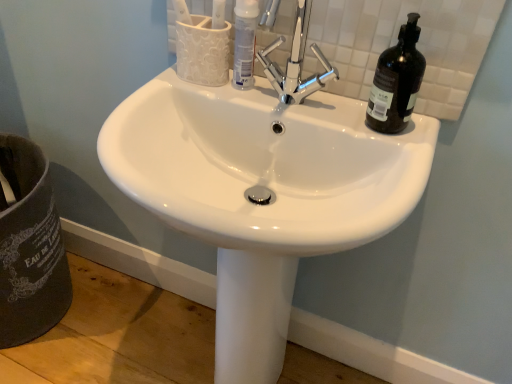
Question: Considering the relative positions of black glass bottle at upper right and white glossy tube at center in the image provided, is black glass bottle at upper right to the left of white glossy tube at center from the viewer's perspective?

Choices:
 (A) no
 (B) yes

Answer: (A)

Question: Can you confirm if black glass bottle at upper right is shorter than white glossy tube at center?

Choices:
 (A) yes
 (B) no

Answer: (B)

Question: Is black glass bottle at upper right in contact with white glossy tube at center?

Choices:
 (A) yes
 (B) no

Answer: (B)

Question: Would you say black glass bottle at upper right contains white glossy tube at center?

Choices:
 (A) no
 (B) yes

Answer: (A)

Question: From a real-world perspective, is black glass bottle at upper right beneath white glossy tube at center?

Choices:
 (A) yes
 (B) no

Answer: (B)

Question: From a real-world perspective, is black glass bottle at upper right on top of white glossy tube at center?

Choices:
 (A) yes
 (B) no

Answer: (A)

Question: Is white glossy tube at center at the back of white glossy sink at center?

Choices:
 (A) yes
 (B) no

Answer: (B)

Question: From the image's perspective, is white glossy sink at center on top of white glossy tube at center?

Choices:
 (A) yes
 (B) no

Answer: (B)

Question: From a real-world perspective, is white glossy sink at center beneath white glossy tube at center?

Choices:
 (A) yes
 (B) no

Answer: (A)

Question: Is white glossy sink at center at the right side of white glossy tube at center?

Choices:
 (A) no
 (B) yes

Answer: (A)

Question: Considering the relative sizes of white glossy sink at center and white glossy tube at center in the image provided, is white glossy sink at center taller than white glossy tube at center?

Choices:
 (A) no
 (B) yes

Answer: (B)

Question: From a real-world perspective, is white glossy sink at center over white glossy tube at center?

Choices:
 (A) yes
 (B) no

Answer: (B)

Question: From a real-world perspective, is white glossy sink at center beneath black glass bottle at upper right?

Choices:
 (A) no
 (B) yes

Answer: (B)